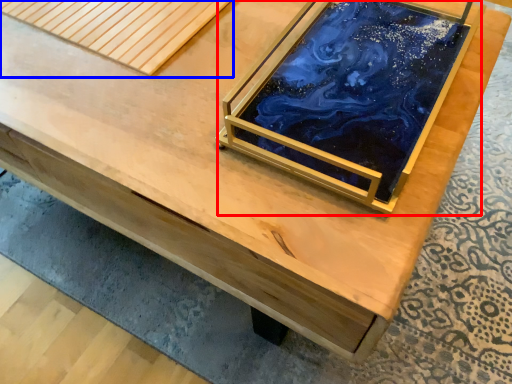
Question: Among these objects, which one is farthest to the camera, glass box (highlighted by a red box) or plank (highlighted by a blue box)?

Choices:
 (A) glass box
 (B) plank

Answer: (B)